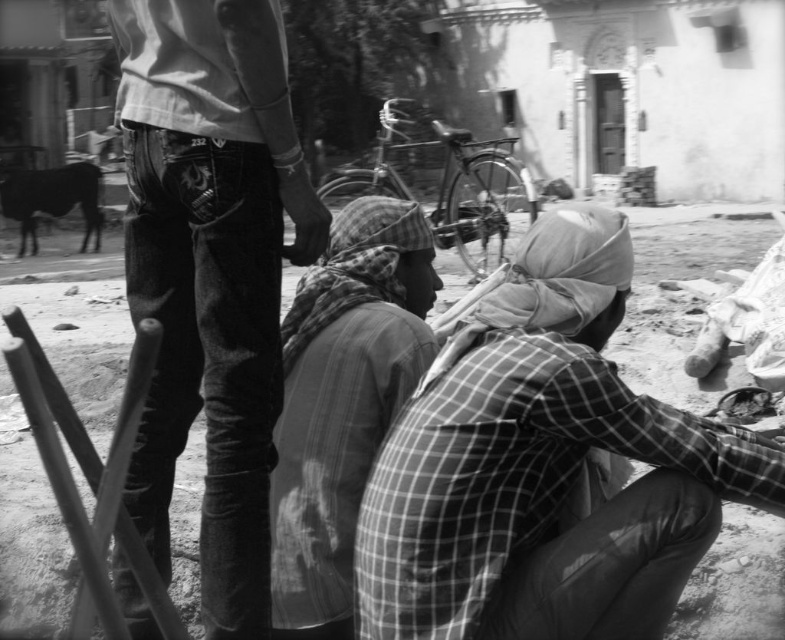
Question: Which of the following is the closest to the observer?

Choices:
 (A) checkered fabric headscarf at center
 (B) checkered fabric headscarf at lower center

Answer: (B)

Question: Among these points, which one is farthest from the camera?

Choices:
 (A) (214, 10)
 (B) (271, 564)

Answer: (B)

Question: Is jeans at center above checkered fabric headscarf at center?

Choices:
 (A) no
 (B) yes

Answer: (B)

Question: Is checkered fabric headscarf at lower center bigger than checkered fabric headscarf at center?

Choices:
 (A) yes
 (B) no

Answer: (A)

Question: Does checkered fabric headscarf at lower center have a smaller size compared to jeans at center?

Choices:
 (A) no
 (B) yes

Answer: (B)

Question: Which point is closer to the camera?

Choices:
 (A) (528, 547)
 (B) (323, 492)
 (C) (254, 182)

Answer: (A)